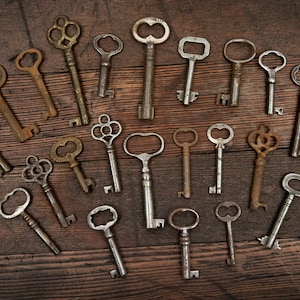
This screenshot has height=300, width=300. Find the location of `wood planks`. wood planks is located at coordinates (137, 267), (129, 228), (127, 86), (127, 45).